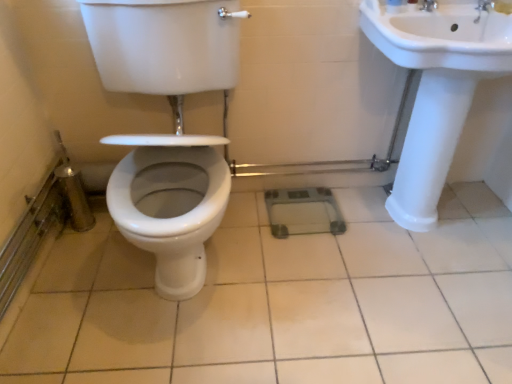
I want to click on free space below white glossy toilet at center (from a real-world perspective), so click(x=204, y=277).